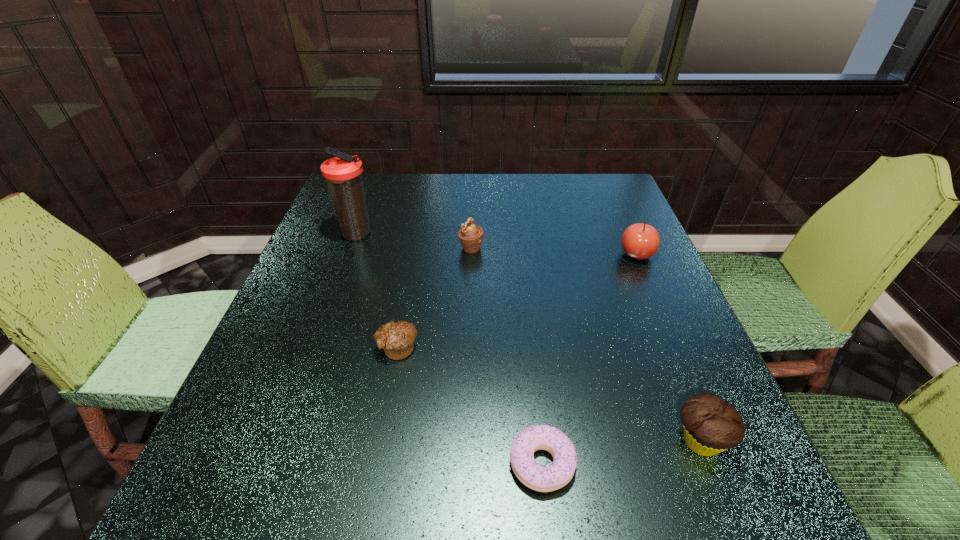
The height and width of the screenshot is (540, 960). Find the location of `thermos bottle`. thermos bottle is located at coordinates (343, 174).

Find the location of `the leftmost object`. the leftmost object is located at coordinates (343, 174).

At what (x,y) coordinates should I click in order to perform the action: click on apple. Please return your answer as a coordinate pair (x, y). Looking at the image, I should click on (640, 241).

Where is `the farthest muffin`? The width and height of the screenshot is (960, 540). the farthest muffin is located at coordinates (470, 235).

At what (x,y) coordinates should I click in order to perform the action: click on the second muffin from right to left. Please return your answer as a coordinate pair (x, y). Image resolution: width=960 pixels, height=540 pixels. Looking at the image, I should click on (470, 235).

Identify the location of the rightmost muffin. (710, 426).

You are a GUI agent. You are given a task and a screenshot of the screen. Output one action in this format:
    pyautogui.click(x=<x>, y=<y>)
    Task: Click on the second shortest object
    This screenshot has width=960, height=540.
    Given the screenshot: What is the action you would take?
    pyautogui.click(x=397, y=339)

Locate an element on the screen. the fourth farthest object is located at coordinates (397, 339).

This screenshot has height=540, width=960. What are the coordinates of `doughnut` in the screenshot? It's located at (537, 477).

This screenshot has width=960, height=540. I want to click on the third object from right to left, so click(537, 477).